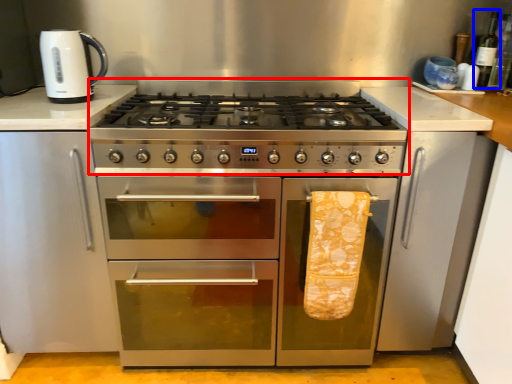
Question: Which point is further to the camera, gas stove (highlighted by a red box) or bottle (highlighted by a blue box)?

Choices:
 (A) gas stove
 (B) bottle

Answer: (B)